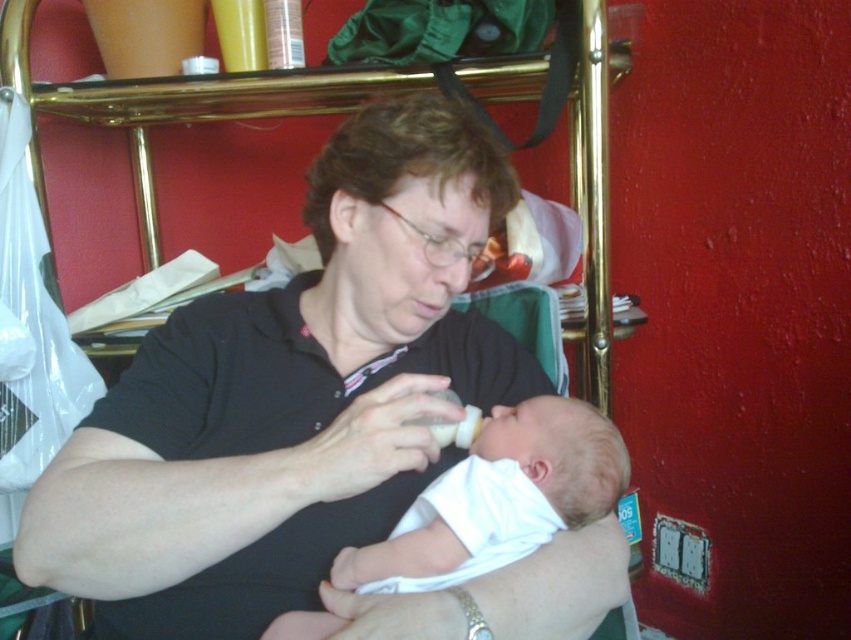
You are a photographer setting up a shot of the adult and baby. You need to ensure that the black matte shirt at center and the white matte baby bottle at center are both in focus. Since the shirt is wider, which object should you adjust your camera settings to prioritize focusing on first?

The black matte shirt at center has a larger width than the white matte baby bottle at center, so you should prioritize focusing on the black matte shirt at center first to ensure proper depth of field coverage.

You are a photographer trying to capture a closeup of the black matte shirt at center and the white matte baby at center. Since you want to focus on both subjects equally, which one should you adjust your camera focus on first considering their sizes?

The black matte shirt at center is larger than the white matte baby at center, so you should focus on the larger black matte shirt at center first to ensure both are in focus.

You are a photographer trying to capture a candid shot of the baby in the scene. You notice two points marked in the image. The first point is at coordinate point (326,634) and the second is at point (431,429). Which point is closer to the camera, and why?

Point (326,634) is closer to the viewer than point (431,429) because it is positioned nearer in the spatial arrangement of the scene.